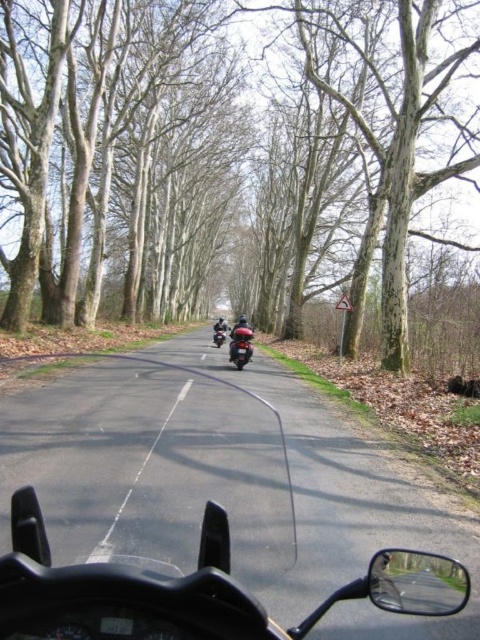
You are riding a motorcycle and see the smooth bark tree at center and the white asphalt road at center ahead. Which object is closer to you?

The smooth bark tree at center is closer to you than the white asphalt road at center because it is positioned further to the viewer in the scene.

You are riding a motorcycle and see two motorcycles ahead on the road. Which one is closer to the left side of the road? The shiny black motorcycle at center or the black matte motorcycle at center?

The shiny black motorcycle at center is closer to the left side of the road because it is positioned to the left of the black matte motorcycle at center.

You are riding a motorcycle and want to know which motorcycle is closer to you between the shiny black motorcycle at center and the black matte motorcycle at center. Which one is closer?

The shiny black motorcycle at center is closer to you because it is positioned below the black matte motorcycle at center in the image, indicating it is nearer in the scene.